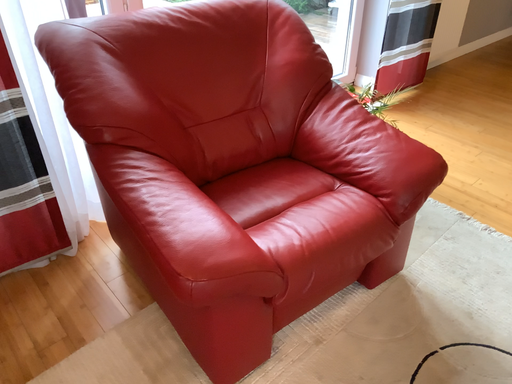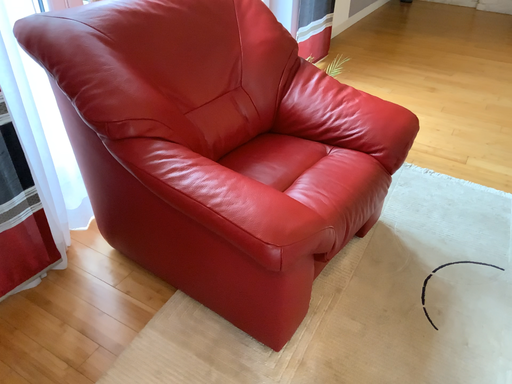
Question: Which way did the camera rotate in the video?

Choices:
 (A) rotated left
 (B) rotated right

Answer: (B)